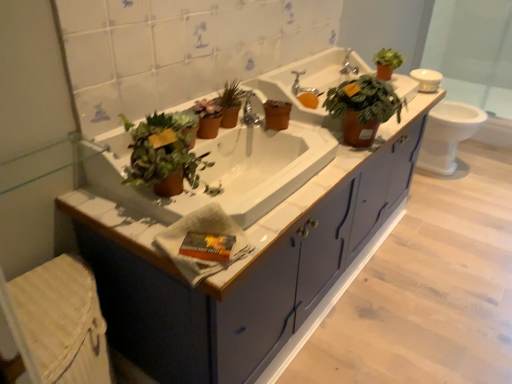
Question: In which direction should I rotate to look at silver metallic faucet at center, which is counted as the 1th faucet, starting from the bottom?

Choices:
 (A) right
 (B) left

Answer: (A)

Question: Considering the relative positions of matte blue cabinet at center and matte brown pot at center in the image provided, is matte blue cabinet at center in front of matte brown pot at center?

Choices:
 (A) yes
 (B) no

Answer: (A)

Question: From a real-world perspective, does matte blue cabinet at center stand above matte brown pot at center?

Choices:
 (A) yes
 (B) no

Answer: (B)

Question: Does matte blue cabinet at center have a larger size compared to matte brown pot at center?

Choices:
 (A) yes
 (B) no

Answer: (A)

Question: Is matte brown pot at center at the back of matte blue cabinet at center?

Choices:
 (A) yes
 (B) no

Answer: (B)

Question: From the image's perspective, is matte blue cabinet at center on matte brown pot at center?

Choices:
 (A) no
 (B) yes

Answer: (A)

Question: Does matte blue cabinet at center have a lesser width compared to matte brown pot at center?

Choices:
 (A) no
 (B) yes

Answer: (A)

Question: From the image's perspective, does matte blue cabinet at center appear lower than matte ceramic sink at center, the 1th sink in the back-to-front sequence?

Choices:
 (A) yes
 (B) no

Answer: (A)

Question: Considering the relative sizes of matte blue cabinet at center and matte ceramic sink at center, marked as the 2th sink in a front-to-back arrangement, in the image provided, is matte blue cabinet at center shorter than matte ceramic sink at center, marked as the 2th sink in a front-to-back arrangement,?

Choices:
 (A) yes
 (B) no

Answer: (A)

Question: Is matte blue cabinet at center at the left side of matte ceramic sink at center, marked as the 2th sink in a front-to-back arrangement?

Choices:
 (A) no
 (B) yes

Answer: (A)

Question: Is matte blue cabinet at center closer to the viewer compared to matte ceramic sink at center, the 1th sink in the back-to-front sequence?

Choices:
 (A) no
 (B) yes

Answer: (B)

Question: Does matte blue cabinet at center appear on the right side of matte ceramic sink at center, the 1th sink in the back-to-front sequence?

Choices:
 (A) yes
 (B) no

Answer: (A)

Question: Considering the relative sizes of matte blue cabinet at center and matte ceramic sink at center, the 1th sink in the back-to-front sequence, in the image provided, is matte blue cabinet at center wider than matte ceramic sink at center, the 1th sink in the back-to-front sequence,?

Choices:
 (A) yes
 (B) no

Answer: (B)

Question: Is white textured hand towel at center to the right of matte blue cabinet at center from the viewer's perspective?

Choices:
 (A) yes
 (B) no

Answer: (B)